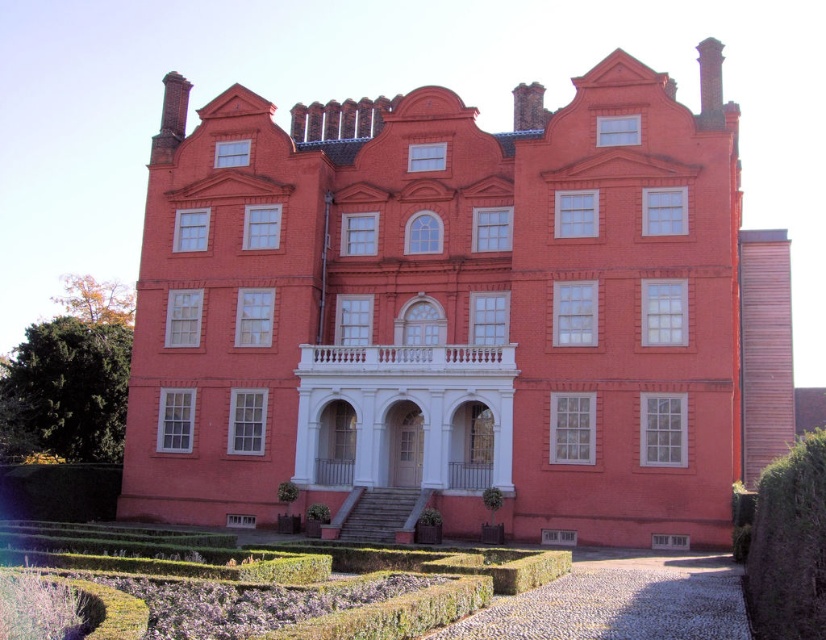
Where is `green hedge at lower center`? This screenshot has height=640, width=826. green hedge at lower center is located at coordinates (292, 570).

Is green leafy hedge at lower left taller than dark green textured hedge at lower right?

Yes.

Who is positioned more to the left, green leafy hedge at lower left or dark green textured hedge at lower right?

From the viewer's perspective, green leafy hedge at lower left appears more on the left side.

Is point (107, 376) positioned in front of point (772, 616)?

No, it is behind (772, 616).

Identify the location of green leafy hedge at lower left. (65, 390).

Does matte brick mansion at center have a larger size compared to green hedge at lower center?

Yes.

Is point (254, 221) positioned in front of point (278, 544)?

No, (254, 221) is further to viewer.

The image size is (826, 640). I want to click on matte brick mansion at center, so click(445, 308).